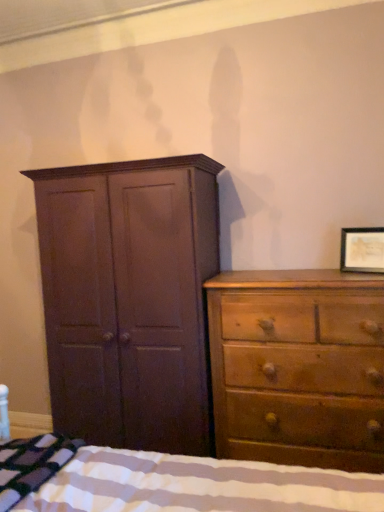
Image resolution: width=384 pixels, height=512 pixels. Describe the element at coordinates (129, 298) in the screenshot. I see `matte brown cupboard at left` at that location.

The image size is (384, 512). In order to click on wooden framed picture at upper right in this screenshot , I will do `click(362, 250)`.

Locate an element on the screen. Image resolution: width=384 pixels, height=512 pixels. striped cotton blanket at lower left is located at coordinates (32, 464).

Between matte brown cupboard at left and wooden framed picture at upper right, which one has more height?

matte brown cupboard at left is taller.

How many degrees apart are the facing directions of matte brown cupboard at left and wooden framed picture at upper right?

They differ by 24 degrees in their facing directions.

Looking at the image, does matte brown cupboard at left seem bigger or smaller compared to wooden framed picture at upper right?

Clearly, matte brown cupboard at left is larger in size than wooden framed picture at upper right.

Would you consider matte brown cupboard at left to be distant from wooden framed picture at upper right?

matte brown cupboard at left is positioned a significant distance from wooden framed picture at upper right.

Is light brown wood dresser at right turned away from wooden framed picture at upper right?

No, light brown wood dresser at right is not facing away from wooden framed picture at upper right.

Find the location of `chest of drawers on the left of wooden framed picture at upper right`. chest of drawers on the left of wooden framed picture at upper right is located at coordinates (298, 367).

Is light brown wood dresser at right not close to wooden framed picture at upper right?

That's not correct — light brown wood dresser at right is a little close to wooden framed picture at upper right.

Can you confirm if light brown wood dresser at right is positioned to the right of wooden framed picture at upper right?

In fact, light brown wood dresser at right is to the left of wooden framed picture at upper right.

In the image, is striped cotton blanket at lower left on the left side or the right side of wooden framed picture at upper right?

striped cotton blanket at lower left is positioned on wooden framed picture at upper right's left side.

Is point (62, 456) farther from camera compared to point (363, 262)?

That is False.

Looking at the image, does striped cotton blanket at lower left seem bigger or smaller compared to wooden framed picture at upper right?

Clearly, striped cotton blanket at lower left is larger in size than wooden framed picture at upper right.

Is striped cotton blanket at lower left inside the boundaries of wooden framed picture at upper right, or outside?

striped cotton blanket at lower left is not inside wooden framed picture at upper right, it's outside.

Which object is more forward, matte brown cupboard at left or striped fabric bed at lower left?

striped fabric bed at lower left is more forward.

Could striped fabric bed at lower left be considered to be inside matte brown cupboard at left?

No, striped fabric bed at lower left is located outside of matte brown cupboard at left.

Which point is more distant from viewer, (x=65, y=302) or (x=125, y=474)?

The point (x=65, y=302) is farther from the camera.

Where is `bed that appears below the matte brown cupboard at left (from a real-world perspective)`? The image size is (384, 512). bed that appears below the matte brown cupboard at left (from a real-world perspective) is located at coordinates (172, 482).

Is striped fabric bed at lower left positioned in front of light brown wood dresser at right?

Yes.

Would you say striped fabric bed at lower left is to the left or to the right of light brown wood dresser at right in the picture?

striped fabric bed at lower left is to the left of light brown wood dresser at right.

Which of these two, striped fabric bed at lower left or light brown wood dresser at right, is wider?

striped fabric bed at lower left is wider.

Does striped fabric bed at lower left have a lesser height compared to light brown wood dresser at right?

Indeed, striped fabric bed at lower left has a lesser height compared to light brown wood dresser at right.

At what (x,y) coordinates should I click in order to perform the action: click on blanket located on the left of light brown wood dresser at right. Please return your answer as a coordinate pair (x, y). This screenshot has width=384, height=512. Looking at the image, I should click on (32, 464).

From the image's perspective, which is below, striped cotton blanket at lower left or light brown wood dresser at right?

striped cotton blanket at lower left.

From a real-world perspective, which object stands above the other?

light brown wood dresser at right, from a real-world perspective.

Locate an element on the screen. Image resolution: width=384 pixels, height=512 pixels. picture frame that appears on the right of light brown wood dresser at right is located at coordinates (362, 250).

Between wooden framed picture at upper right and light brown wood dresser at right, which one has less height?

wooden framed picture at upper right.

Measure the distance from wooden framed picture at upper right to light brown wood dresser at right.

wooden framed picture at upper right is 20.77 inches away from light brown wood dresser at right.

Is wooden framed picture at upper right at the left side of light brown wood dresser at right?

No, wooden framed picture at upper right is not to the left of light brown wood dresser at right.

This screenshot has height=512, width=384. In order to click on picture frame lying behind the matte brown cupboard at left in this screenshot , I will do `click(362, 250)`.

Where is `picture frame located above the light brown wood dresser at right (from the image's perspective)`? picture frame located above the light brown wood dresser at right (from the image's perspective) is located at coordinates click(362, 250).

In the scene shown: Which object lies further to the anchor point striped fabric bed at lower left, matte brown cupboard at left or wooden framed picture at upper right?

Among the two, wooden framed picture at upper right is located further to striped fabric bed at lower left.

Based on their spatial positions, is striped cotton blanket at lower left or wooden framed picture at upper right closer to striped fabric bed at lower left?

The object closer to striped fabric bed at lower left is striped cotton blanket at lower left.

Considering their positions, is matte brown cupboard at left positioned further to wooden framed picture at upper right than striped cotton blanket at lower left?

The object further to wooden framed picture at upper right is striped cotton blanket at lower left.

Estimate the real-world distances between objects in this image. Which object is further from striped fabric bed at lower left, matte brown cupboard at left or striped cotton blanket at lower left?

matte brown cupboard at left.

Based on their spatial positions, is matte brown cupboard at left or light brown wood dresser at right closer to striped cotton blanket at lower left?

matte brown cupboard at left lies closer to striped cotton blanket at lower left than the other object.

When comparing their distances from light brown wood dresser at right, does striped cotton blanket at lower left or striped fabric bed at lower left seem closer?

striped fabric bed at lower left lies closer to light brown wood dresser at right than the other object.

From the image, which object appears to be farther from light brown wood dresser at right, matte brown cupboard at left or wooden framed picture at upper right?

Among the two, wooden framed picture at upper right is located further to light brown wood dresser at right.

From the image, which object appears to be farther from wooden framed picture at upper right, matte brown cupboard at left or light brown wood dresser at right?

matte brown cupboard at left.

The image size is (384, 512). I want to click on cupboard located between striped cotton blanket at lower left and light brown wood dresser at right in the left-right direction, so click(x=129, y=298).

Identify the location of chest of drawers between striped fabric bed at lower left and wooden framed picture at upper right in the front-back direction. The height and width of the screenshot is (512, 384). (298, 367).

This screenshot has width=384, height=512. I want to click on blanket between striped fabric bed at lower left and matte brown cupboard at left along the z-axis, so click(32, 464).

This screenshot has height=512, width=384. Identify the location of blanket located between striped fabric bed at lower left and light brown wood dresser at right in the depth direction. (32, 464).